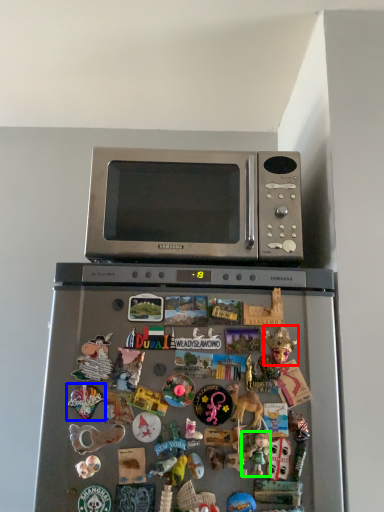
Question: Which object is positioned farthest from toy (highlighted by a red box)? Select from toy (highlighted by a blue box) and toy (highlighted by a green box).

Choices:
 (A) toy
 (B) toy

Answer: (A)